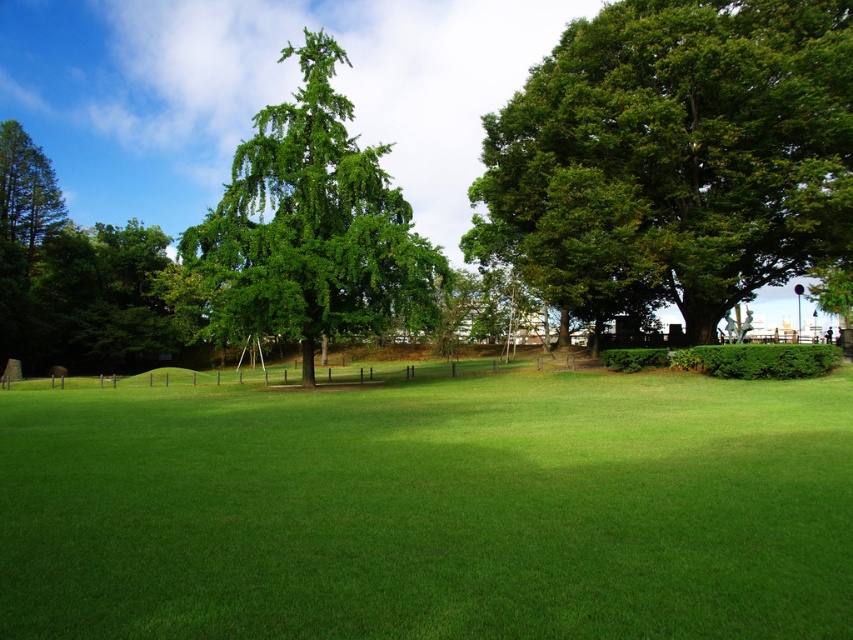
Does green leafy tree at right have a greater height compared to green leafy tree at center?

In fact, green leafy tree at right may be shorter than green leafy tree at center.

Is point (634, 35) closer to camera compared to point (376, 250)?

Yes, point (634, 35) is in front of point (376, 250).

Where is `green leafy tree at right`? This screenshot has height=640, width=853. green leafy tree at right is located at coordinates (675, 154).

Between green grass at center and green leafy tree at center, which one appears on the right side from the viewer's perspective?

green grass at center is more to the right.

Looking at this image, between green grass at center and green leafy tree at center, which one has more height?

With more height is green leafy tree at center.

Which is in front, point (3, 547) or point (206, 298)?

Point (3, 547) is more forward.

Locate an element on the screen. The width and height of the screenshot is (853, 640). green grass at center is located at coordinates (430, 508).

Is green grass at center positioned at the back of green leafy tree at right?

No.

How far apart are green grass at center and green leafy tree at right?

15.08 meters

Find the location of a particular element. green grass at center is located at coordinates (430, 508).